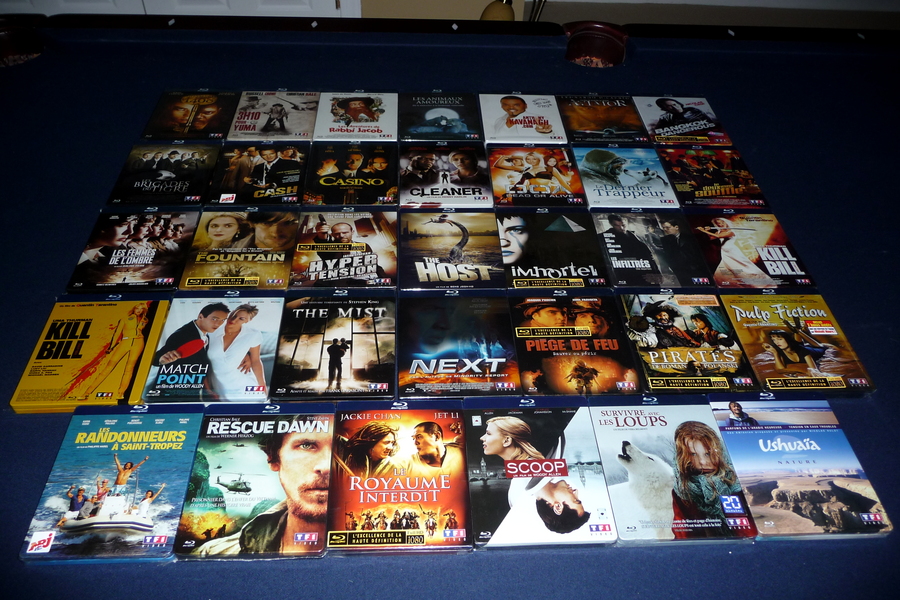
Locate an element on the screen. Image resolution: width=900 pixels, height=600 pixels. movie cases in top row is located at coordinates (201, 106), (275, 106), (361, 106), (434, 118), (500, 117), (618, 124), (699, 121).